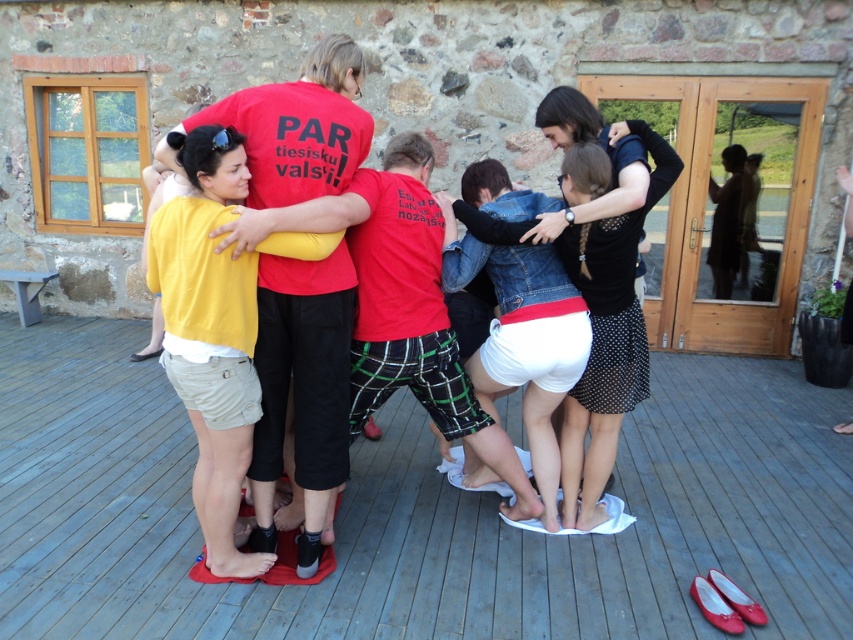
The width and height of the screenshot is (853, 640). Describe the element at coordinates (416, 513) in the screenshot. I see `wooden deck at center` at that location.

Can you confirm if wooden deck at center is wider than yellow cotton shirt at left?

Indeed, wooden deck at center has a greater width compared to yellow cotton shirt at left.

At what (x,y) coordinates should I click in order to perform the action: click on wooden deck at center. Please return your answer as a coordinate pair (x, y). The width and height of the screenshot is (853, 640). Looking at the image, I should click on (416, 513).